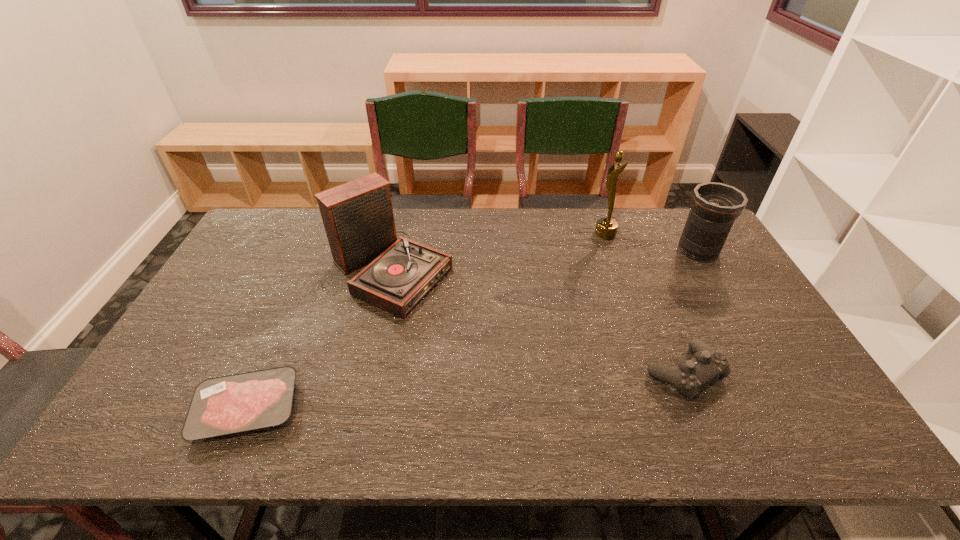
Locate an element on the screen. object that is at the far right corner is located at coordinates (715, 206).

In the image, there is a desktop. Where is `free space at the far edge`? Image resolution: width=960 pixels, height=540 pixels. free space at the far edge is located at coordinates coord(480,237).

Where is `vacant space at the near edge`? The height and width of the screenshot is (540, 960). vacant space at the near edge is located at coordinates (257, 442).

Identify the location of free space at the right edge. (809, 393).

This screenshot has height=540, width=960. I want to click on free space at the far left corner of the desktop, so click(281, 219).

The image size is (960, 540). I want to click on free space between the third shortest object and the tallest object, so click(x=652, y=242).

In order to click on free space between the tallest object and the second tallest object in this screenshot , I will do `click(498, 253)`.

Find the location of a particular element. Image resolution: width=960 pixels, height=540 pixels. vacant region between the steak and the rightmost object is located at coordinates (472, 329).

Where is `unoccupied position between the shortest object and the phonograph record`? unoccupied position between the shortest object and the phonograph record is located at coordinates (319, 340).

Where is `free spot between the control and the phonograph record`? The image size is (960, 540). free spot between the control and the phonograph record is located at coordinates (538, 322).